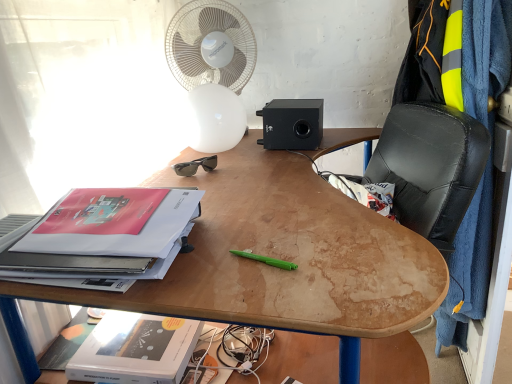
You are a GUI agent. You are given a task and a screenshot of the screen. Output one action in this format:
    pyautogui.click(x=<x>, y=<y>)
    Task: Click on the vacant space that is in between matte paper stack at left, which is counted as the second paperback book, starting from the bottom, and green plastic pen at center
    
    Given the screenshot: What is the action you would take?
    (223, 250)